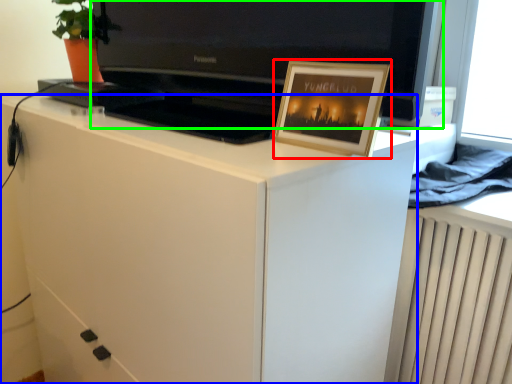
Question: Which object is the farthest from picture frame (highlighted by a red box)? Choose among these: cabinetry (highlighted by a blue box) or television (highlighted by a green box).

Choices:
 (A) cabinetry
 (B) television

Answer: (B)